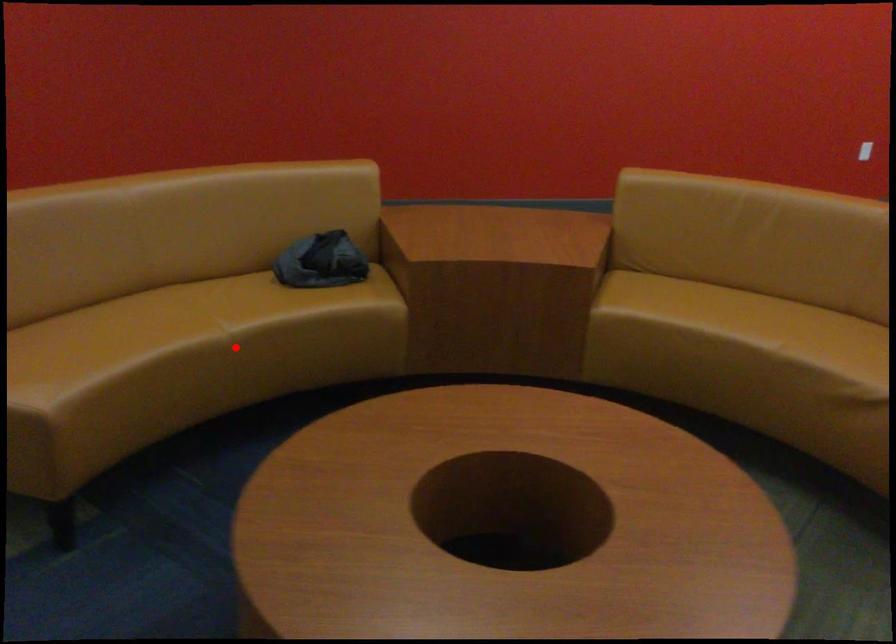
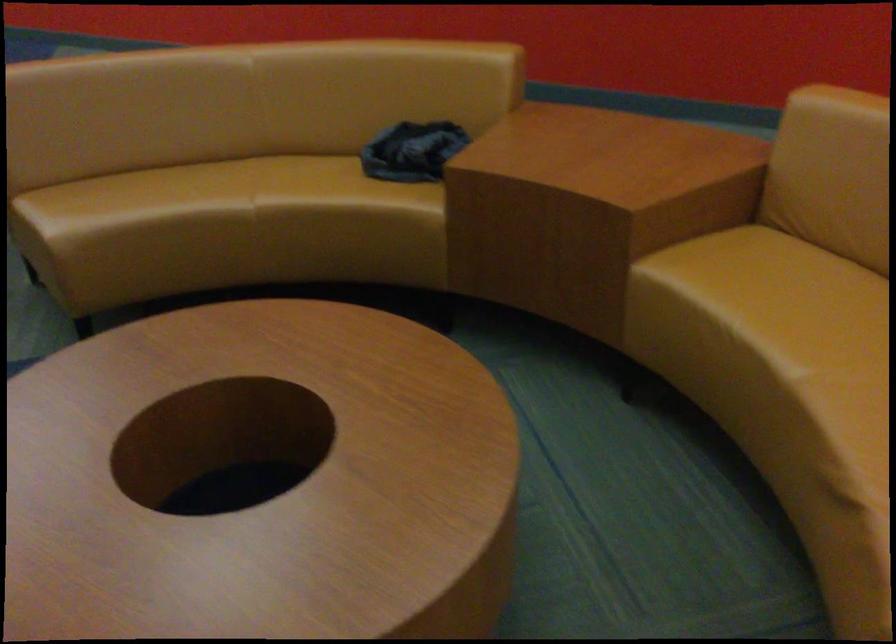
In the second image, find the point that corresponds to the highlighted location in the first image.

(255, 220)